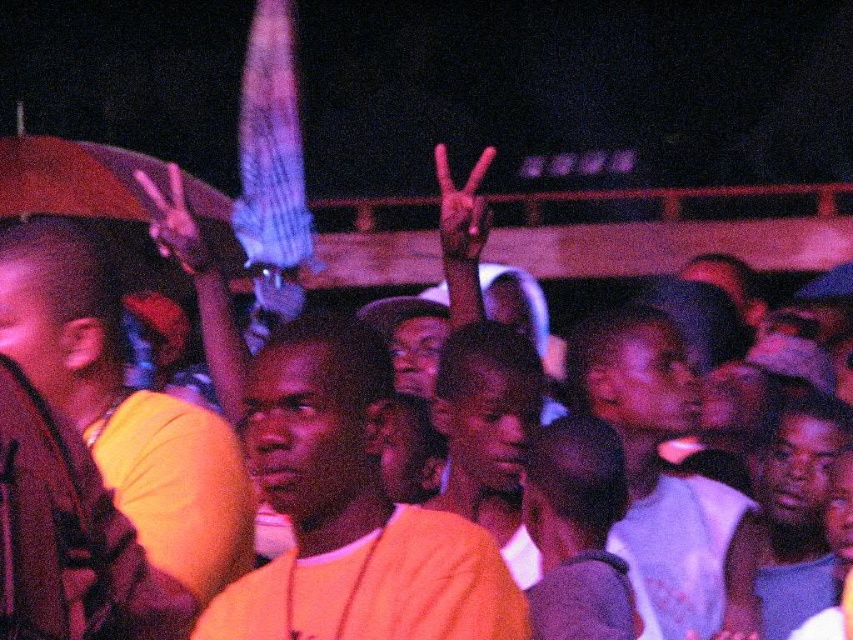
Question: Does orange cotton shirt at center have a smaller size compared to white cotton shirt at center?

Choices:
 (A) no
 (B) yes

Answer: (B)

Question: Which point is closer to the camera?

Choices:
 (A) white cotton shirt at center
 (B) orange cotton shirt at center

Answer: (B)

Question: Among these objects, which one is nearest to the camera?

Choices:
 (A) white cotton shirt at center
 (B) orange cotton shirt at center

Answer: (B)

Question: Which point appears closest to the camera in this image?

Choices:
 (A) (670, 419)
 (B) (433, 516)

Answer: (B)

Question: Is orange cotton shirt at center above white cotton shirt at center?

Choices:
 (A) yes
 (B) no

Answer: (A)

Question: Where is orange cotton shirt at center located in relation to white cotton shirt at center in the image?

Choices:
 (A) right
 (B) left

Answer: (B)